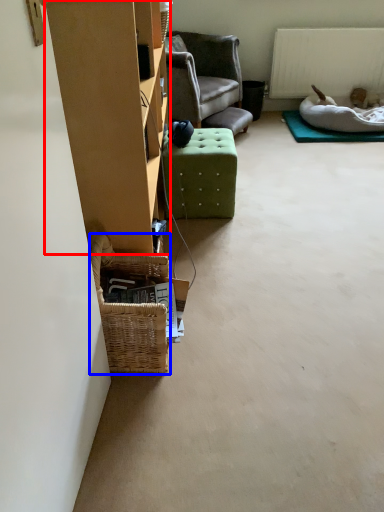
Question: Which point is closer to the camera, furniture (highlighted by a red box) or picnic basket (highlighted by a blue box)?

Choices:
 (A) furniture
 (B) picnic basket

Answer: (A)